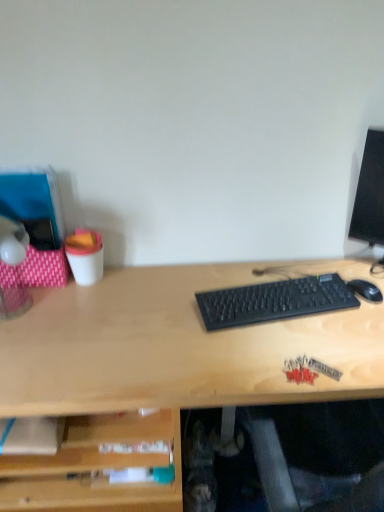
Question: Is black plastic keyboard at center wider than black matte mouse at right?

Choices:
 (A) yes
 (B) no

Answer: (A)

Question: From the image's perspective, is black plastic keyboard at center on top of black matte mouse at right?

Choices:
 (A) no
 (B) yes

Answer: (A)

Question: From the image's perspective, is black plastic keyboard at center under black matte mouse at right?

Choices:
 (A) yes
 (B) no

Answer: (A)

Question: Is black plastic keyboard at center facing away from black matte mouse at right?

Choices:
 (A) yes
 (B) no

Answer: (B)

Question: Is black plastic keyboard at center closer to camera compared to black matte mouse at right?

Choices:
 (A) yes
 (B) no

Answer: (A)

Question: Looking at the image, does black matte mouse at right seem bigger or smaller compared to translucent plastic lamp at left?

Choices:
 (A) small
 (B) big

Answer: (A)

Question: From their relative heights in the image, would you say black matte mouse at right is taller or shorter than translucent plastic lamp at left?

Choices:
 (A) short
 (B) tall

Answer: (A)

Question: From a real-world perspective, is black matte mouse at right above or below translucent plastic lamp at left?

Choices:
 (A) above
 (B) below

Answer: (B)

Question: Looking at their shapes, would you say black matte mouse at right is wider or thinner than translucent plastic lamp at left?

Choices:
 (A) thin
 (B) wide

Answer: (A)

Question: Visually, is black matte mouse at right positioned to the left or to the right of black plastic keyboard at center?

Choices:
 (A) left
 (B) right

Answer: (B)

Question: Is black matte mouse at right situated inside black plastic keyboard at center or outside?

Choices:
 (A) inside
 (B) outside

Answer: (B)

Question: In terms of width, does black matte mouse at right look wider or thinner when compared to black plastic keyboard at center?

Choices:
 (A) wide
 (B) thin

Answer: (B)

Question: From the image's perspective, is black matte mouse at right positioned above or below black plastic keyboard at center?

Choices:
 (A) below
 (B) above

Answer: (B)

Question: Would you say translucent plastic lamp at left is to the left or to the right of black plastic keyboard at center in the picture?

Choices:
 (A) left
 (B) right

Answer: (A)

Question: Considering the positions of translucent plastic lamp at left and black plastic keyboard at center in the image, is translucent plastic lamp at left wider or thinner than black plastic keyboard at center?

Choices:
 (A) wide
 (B) thin

Answer: (A)